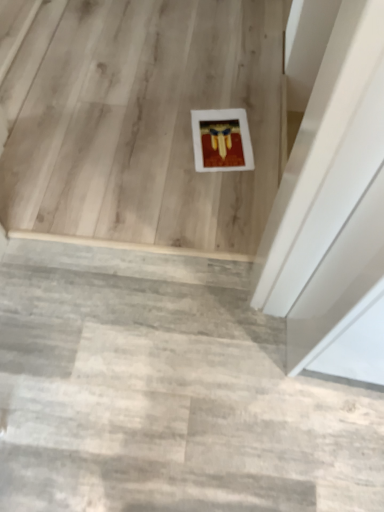
What do you see at coordinates (165, 392) in the screenshot? I see `concrete textured stairs at center, the 1th stairwell in the front-to-back sequence` at bounding box center [165, 392].

The image size is (384, 512). In order to click on concrete textured stairs at center, the 1th stairwell in the front-to-back sequence in this screenshot , I will do `click(165, 392)`.

Describe the element at coordinates (142, 122) in the screenshot. The image size is (384, 512). I see `white matte frame at center, the 2th stairwell in the bottom-to-top sequence` at that location.

What are the coordinates of `white matte frame at center, the 2th stairwell in the bottom-to-top sequence` in the screenshot? It's located at (142, 122).

I want to click on concrete textured stairs at center, the second stairwell viewed from the back, so click(165, 392).

Does concrete textured stairs at center, the second stairwell viewed from the back, appear on the left side of white matte frame at center, acting as the first stairwell starting from the back?

Incorrect, concrete textured stairs at center, the second stairwell viewed from the back, is not on the left side of white matte frame at center, acting as the first stairwell starting from the back.

Relative to white matte frame at center, the second stairwell positioned from the front, is concrete textured stairs at center, the second stairwell viewed from the back, in front or behind?

concrete textured stairs at center, the second stairwell viewed from the back, is positioned closer to the viewer than white matte frame at center, the second stairwell positioned from the front.

Does point (292, 490) appear closer or farther from the camera than point (131, 24)?

Point (292, 490) appears to be closer to the viewer than point (131, 24).

From the image's perspective, relative to white matte frame at center, positioned as the 1th stairwell in top-to-bottom order, is concrete textured stairs at center, the 1th stairwell in the front-to-back sequence, above or below?

Clearly, from the image's perspective, concrete textured stairs at center, the 1th stairwell in the front-to-back sequence, is below white matte frame at center, positioned as the 1th stairwell in top-to-bottom order.

From a real-world perspective, does concrete textured stairs at center, the second stairwell viewed from the back, stand above white matte frame at center, positioned as the 1th stairwell in top-to-bottom order?

Yes.

Does concrete textured stairs at center, the second stairwell viewed from the back, have a lesser width compared to white matte frame at center, the second stairwell positioned from the front?

Yes.

From their relative heights in the image, would you say concrete textured stairs at center, the 1th stairwell positioned from the bottom, is taller or shorter than white matte frame at center, acting as the first stairwell starting from the back?

Considering their sizes, concrete textured stairs at center, the 1th stairwell positioned from the bottom, has less height than white matte frame at center, acting as the first stairwell starting from the back.

Considering the sizes of concrete textured stairs at center, the 1th stairwell in the front-to-back sequence, and white matte frame at center, the 2th stairwell in the bottom-to-top sequence, in the image, is concrete textured stairs at center, the 1th stairwell in the front-to-back sequence, bigger or smaller than white matte frame at center, the 2th stairwell in the bottom-to-top sequence,?

In the image, concrete textured stairs at center, the 1th stairwell in the front-to-back sequence, appears to be smaller than white matte frame at center, the 2th stairwell in the bottom-to-top sequence.

Is concrete textured stairs at center, the 1th stairwell in the front-to-back sequence, inside the boundaries of white matte frame at center, the second stairwell positioned from the front, or outside?

concrete textured stairs at center, the 1th stairwell in the front-to-back sequence, cannot be found inside white matte frame at center, the second stairwell positioned from the front.

Is there a large distance between concrete textured stairs at center, the 2th stairwell when ordered from top to bottom, and white matte frame at center, acting as the first stairwell starting from the back?

concrete textured stairs at center, the 2th stairwell when ordered from top to bottom, is actually quite close to white matte frame at center, acting as the first stairwell starting from the back.

Is concrete textured stairs at center, the second stairwell viewed from the back, oriented away from white matte frame at center, the 2th stairwell in the bottom-to-top sequence?

No, concrete textured stairs at center, the second stairwell viewed from the back,'s orientation is not away from white matte frame at center, the 2th stairwell in the bottom-to-top sequence.

What's the angular difference between concrete textured stairs at center, the second stairwell viewed from the back, and white matte frame at center, acting as the first stairwell starting from the back,'s facing directions?

The angle between the facing direction of concrete textured stairs at center, the second stairwell viewed from the back, and the facing direction of white matte frame at center, acting as the first stairwell starting from the back, is 180 degrees.

Measure the distance between concrete textured stairs at center, the second stairwell viewed from the back, and white matte frame at center, the second stairwell positioned from the front.

concrete textured stairs at center, the second stairwell viewed from the back, is 24.67 inches from white matte frame at center, the second stairwell positioned from the front.

Locate an element on the screen. Image resolution: width=384 pixels, height=512 pixels. stairwell below the white matte frame at center, positioned as the 1th stairwell in top-to-bottom order (from the image's perspective) is located at coordinates (165, 392).

Between white matte frame at center, the 2th stairwell in the bottom-to-top sequence, and concrete textured stairs at center, the 1th stairwell in the front-to-back sequence, which one appears on the right side from the viewer's perspective?

Positioned to the right is concrete textured stairs at center, the 1th stairwell in the front-to-back sequence.

Considering the positions of objects white matte frame at center, positioned as the 1th stairwell in top-to-bottom order, and concrete textured stairs at center, the second stairwell viewed from the back, in the image provided, who is behind, white matte frame at center, positioned as the 1th stairwell in top-to-bottom order, or concrete textured stairs at center, the second stairwell viewed from the back,?

white matte frame at center, positioned as the 1th stairwell in top-to-bottom order, is behind.

Is point (157, 244) in front of point (184, 336)?

No, it is not.

In the scene shown: From the image's perspective, who appears lower, white matte frame at center, the second stairwell positioned from the front, or concrete textured stairs at center, the 1th stairwell in the front-to-back sequence?

concrete textured stairs at center, the 1th stairwell in the front-to-back sequence, appears lower in the image.

From the picture: From a real-world perspective, is white matte frame at center, acting as the first stairwell starting from the back, above or below concrete textured stairs at center, the 2th stairwell when ordered from top to bottom?

white matte frame at center, acting as the first stairwell starting from the back, is below concrete textured stairs at center, the 2th stairwell when ordered from top to bottom.

Is white matte frame at center, the second stairwell positioned from the front, thinner than concrete textured stairs at center, the 1th stairwell positioned from the bottom?

Incorrect, the width of white matte frame at center, the second stairwell positioned from the front, is not less than that of concrete textured stairs at center, the 1th stairwell positioned from the bottom.

Consider the image. Which of these two, white matte frame at center, the second stairwell positioned from the front, or concrete textured stairs at center, the 1th stairwell in the front-to-back sequence, stands shorter?

With less height is concrete textured stairs at center, the 1th stairwell in the front-to-back sequence.

Which of these two, white matte frame at center, the 2th stairwell in the bottom-to-top sequence, or concrete textured stairs at center, the 1th stairwell positioned from the bottom, is bigger?

With larger size is white matte frame at center, the 2th stairwell in the bottom-to-top sequence.

Is white matte frame at center, acting as the first stairwell starting from the back, situated inside concrete textured stairs at center, the 1th stairwell positioned from the bottom, or outside?

white matte frame at center, acting as the first stairwell starting from the back, lies outside concrete textured stairs at center, the 1th stairwell positioned from the bottom.

Is white matte frame at center, acting as the first stairwell starting from the back, not near concrete textured stairs at center, the 1th stairwell positioned from the bottom?

They are positioned close to each other.

Is white matte frame at center, acting as the first stairwell starting from the back, oriented away from concrete textured stairs at center, the 2th stairwell when ordered from top to bottom?

No.

Locate an element on the screen. stairwell above the concrete textured stairs at center, the 1th stairwell positioned from the bottom (from the image's perspective) is located at coordinates (142, 122).

Find the location of a particular element. The height and width of the screenshot is (512, 384). stairwell above the concrete textured stairs at center, the 2th stairwell when ordered from top to bottom (from the image's perspective) is located at coordinates (142, 122).

You are a GUI agent. You are given a task and a screenshot of the screen. Output one action in this format:
    pyautogui.click(x=<x>, y=<y>)
    Task: Click on the stairwell located behind the concrete textured stairs at center, the second stairwell viewed from the back
    This screenshot has height=512, width=384.
    Given the screenshot: What is the action you would take?
    pyautogui.click(x=142, y=122)